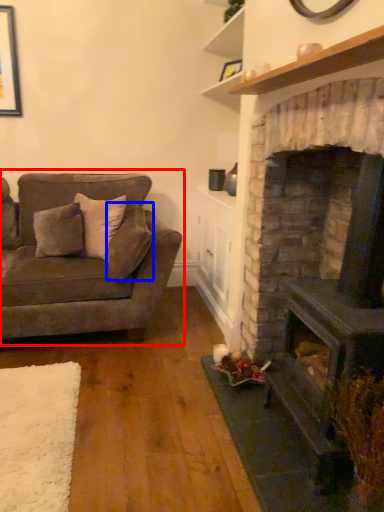
Question: Which of the following is the farthest to the observer, studio couch (highlighted by a red box) or pillow (highlighted by a blue box)?

Choices:
 (A) studio couch
 (B) pillow

Answer: (B)